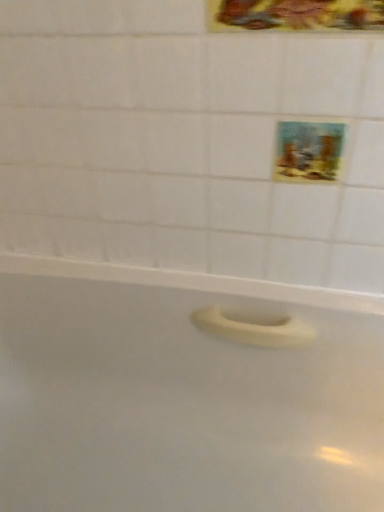
Question: Is point (294, 5) closer or farther from the camera than point (339, 158)?

Choices:
 (A) closer
 (B) farther

Answer: (A)

Question: Choose the correct answer: Is metallic gold frame at upper center, the 2th decorative picture ordered from the bottom, inside pastel painted picture at upper right, placed as the first decorative picture when sorted from back to front, or outside it?

Choices:
 (A) outside
 (B) inside

Answer: (A)

Question: Estimate the real-world distances between objects in this image. Which object is farther from the pastel painted picture at upper right, positioned as the second decorative picture in front-to-back order?

Choices:
 (A) metallic gold frame at upper center, the 2th decorative picture ordered from the bottom
 (B) white matte bathtub at center

Answer: (B)

Question: Which object is the farthest from the pastel painted picture at upper right, the 1th decorative picture positioned from the bottom?

Choices:
 (A) white matte bathtub at center
 (B) metallic gold frame at upper center, the first decorative picture positioned from the front

Answer: (A)